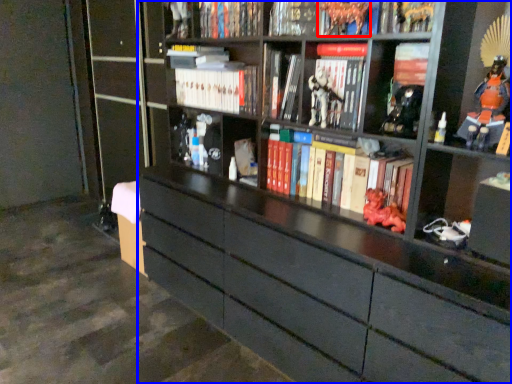
Question: Which point is further to the camera, toy (highlighted by a red box) or bookcase (highlighted by a blue box)?

Choices:
 (A) toy
 (B) bookcase

Answer: (A)